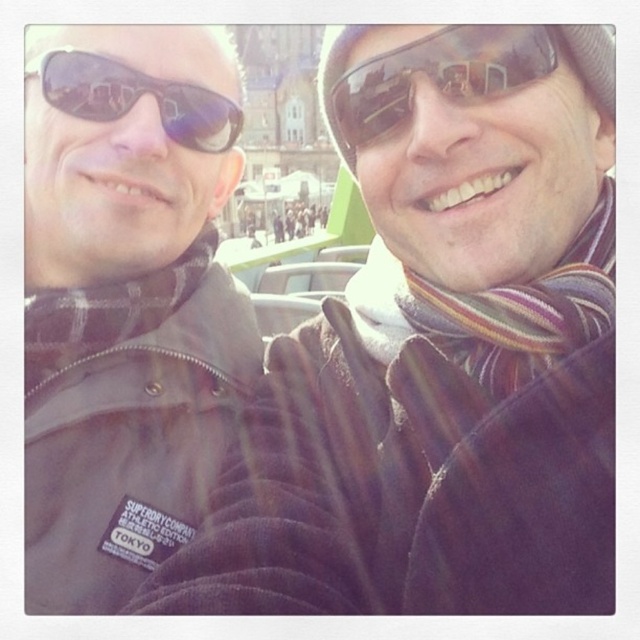
Who is lower down, matte black jacket at left or matte black goggles at upper center?

matte black jacket at left

Does matte black jacket at left have a larger size compared to matte black goggles at upper center?

Indeed, matte black jacket at left has a larger size compared to matte black goggles at upper center.

Is point (358, 400) farther from viewer compared to point (394, 124)?

Yes, point (358, 400) is farther from viewer.

At what (x,y) coordinates should I click in order to perform the action: click on matte black jacket at left. Please return your answer as a coordinate pair (x, y). Looking at the image, I should click on (440, 349).

Consider the image. How much distance is there between matte black goggles at upper center and matte black sunglasses at upper left?

They are 23.15 meters apart.

Where is `matte black goggles at upper center`? matte black goggles at upper center is located at coordinates (435, 76).

Does point (525, 72) come closer to viewer compared to point (100, 67)?

Yes, it is in front of point (100, 67).

You are a GUI agent. You are given a task and a screenshot of the screen. Output one action in this format:
    pyautogui.click(x=<x>, y=<y>)
    Task: Click on the matte black goggles at upper center
    The height and width of the screenshot is (640, 640).
    Given the screenshot: What is the action you would take?
    pyautogui.click(x=435, y=76)

Image resolution: width=640 pixels, height=640 pixels. In order to click on brown corduroy jacket at left in this screenshot , I will do `click(125, 301)`.